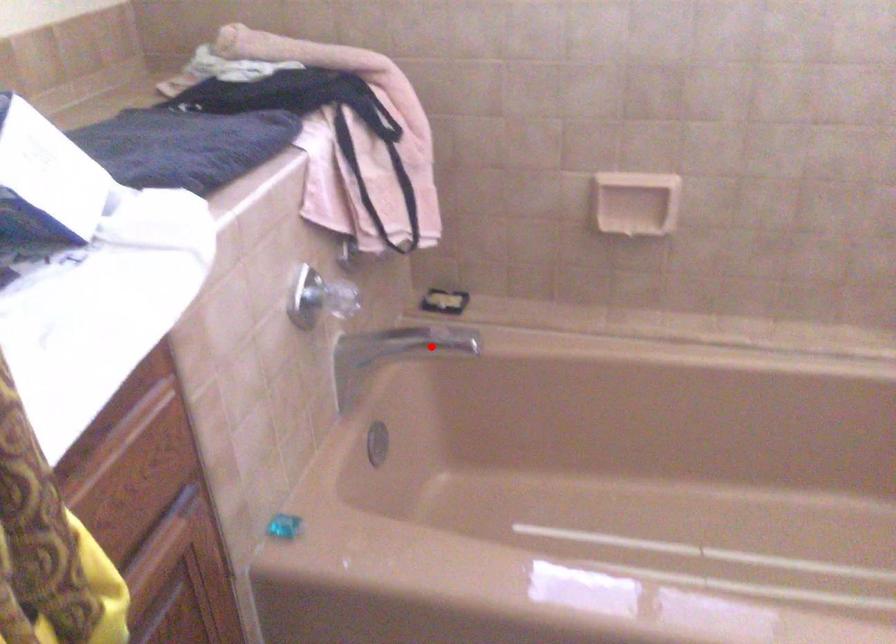
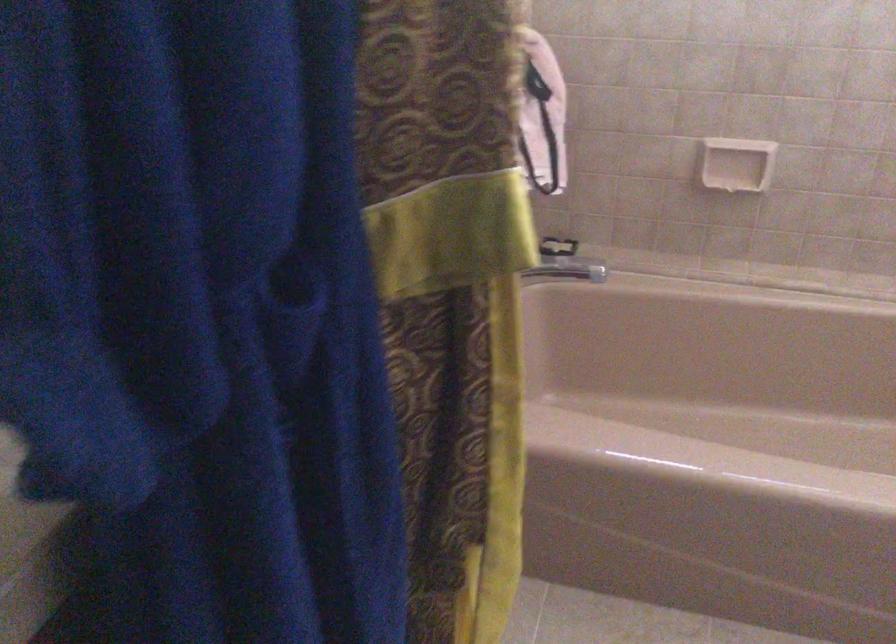
Question: I am providing you with two images of the same scene from different viewpoints. A red point is shown in image1. For the corresponding object point in image2, is it positioned nearer or farther from the camera?

Choices:
 (A) Nearer
 (B) Farther

Answer: (B)